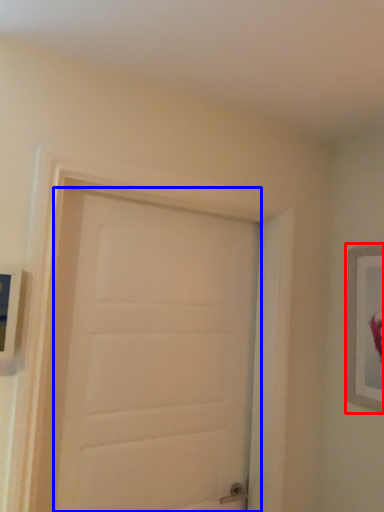
Question: Which point is further to the camera, picture frame (highlighted by a red box) or door (highlighted by a blue box)?

Choices:
 (A) picture frame
 (B) door

Answer: (A)